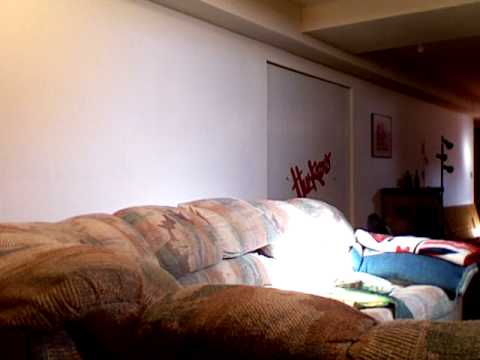
Where is `left armrest`? The height and width of the screenshot is (360, 480). left armrest is located at coordinates (424, 266).